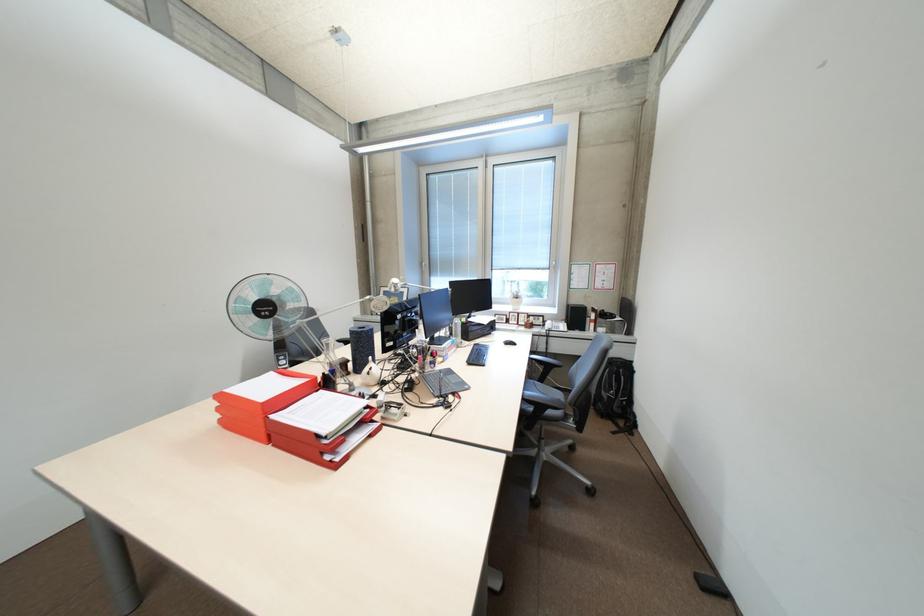
This screenshot has height=616, width=924. In order to click on white plant pot in this screenshot , I will do `click(516, 302)`.